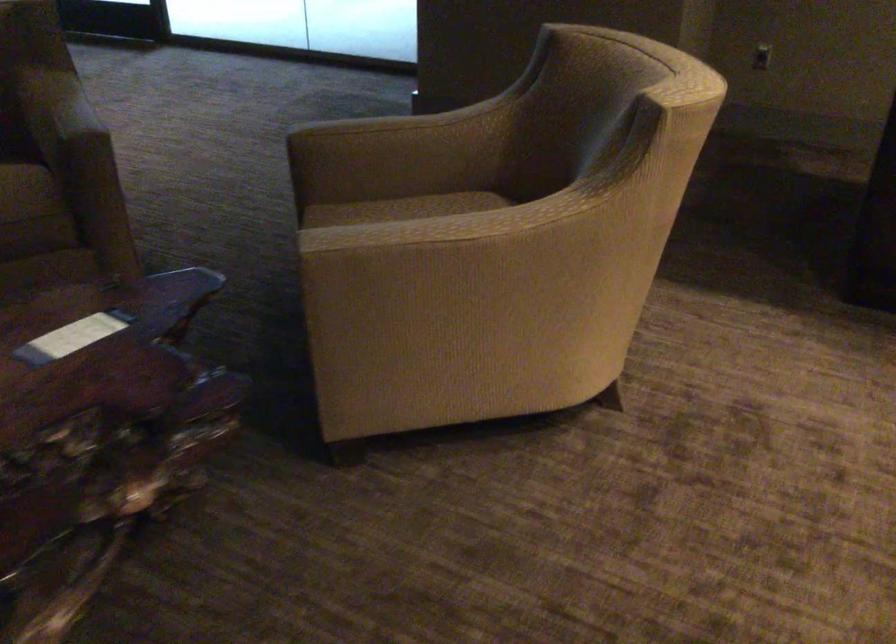
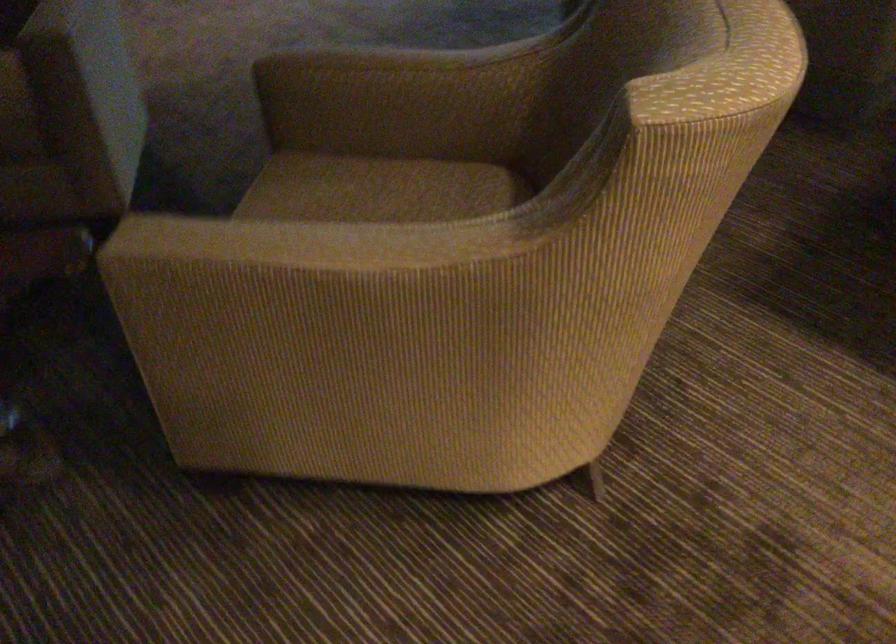
Find the pixel in the second image that matches the point at 412,214 in the first image.

(380, 187)